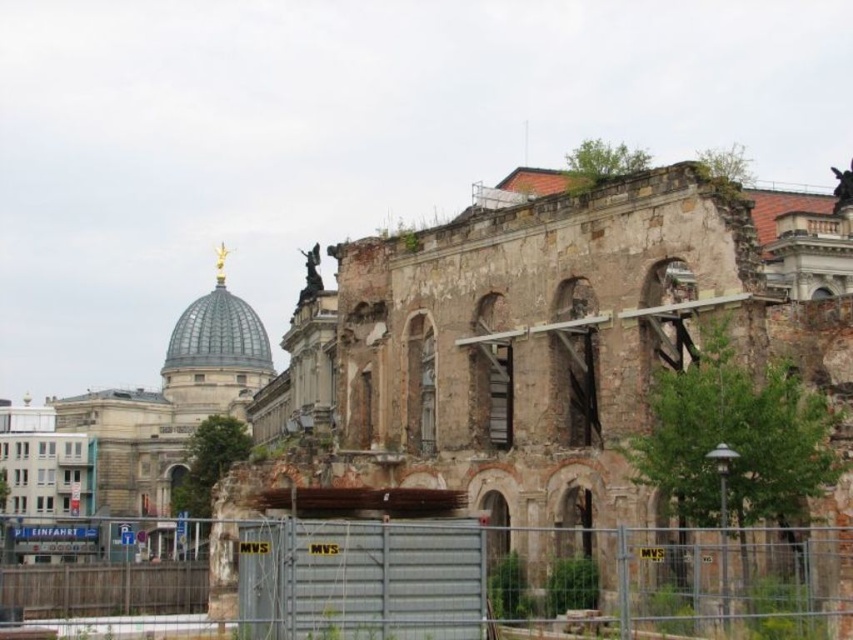
Question: Which point is farther to the camera?

Choices:
 (A) (395, 330)
 (B) (585, 573)

Answer: (A)

Question: Can you confirm if weathered stone ruins at center is wider than metallic gray fence at center?

Choices:
 (A) yes
 (B) no

Answer: (B)

Question: Can you confirm if weathered stone ruins at center is bigger than metallic gray fence at center?

Choices:
 (A) no
 (B) yes

Answer: (B)

Question: Among these points, which one is nearest to the camera?

Choices:
 (A) (851, 397)
 (B) (839, 576)

Answer: (B)

Question: In this image, where is weathered stone ruins at center located relative to metallic gray fence at center?

Choices:
 (A) left
 (B) right

Answer: (B)